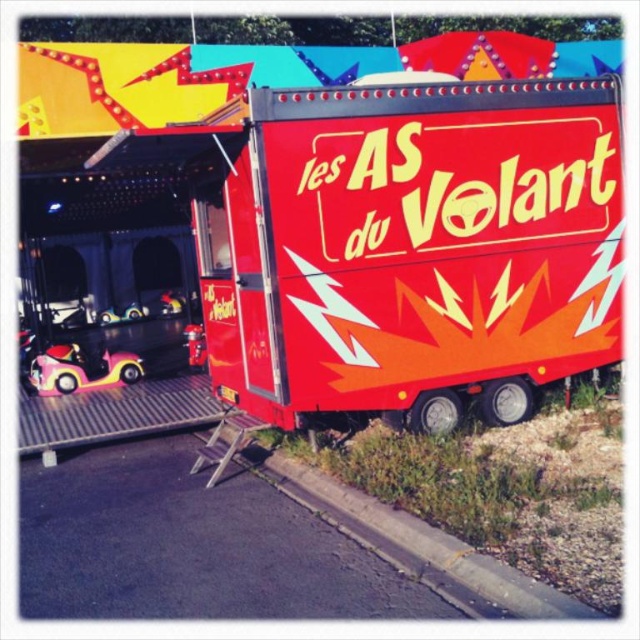
Who is taller, shiny red trailer truck at center or pink rubber bumper car at lower left?

Standing taller between the two is shiny red trailer truck at center.

Looking at this image, which is more to the left, shiny red trailer truck at center or pink rubber bumper car at lower left?

Positioned to the left is pink rubber bumper car at lower left.

Identify the location of shiny red trailer truck at center. The image size is (640, 640). (413, 250).

Does point (492, 140) lie in front of point (202, 538)?

No, (492, 140) is behind (202, 538).

You are a GUI agent. You are given a task and a screenshot of the screen. Output one action in this format:
    pyautogui.click(x=<x>, y=<y>)
    Task: Click on the shiny red trailer truck at center
    The image size is (640, 640).
    Given the screenshot: What is the action you would take?
    pyautogui.click(x=413, y=250)

Based on the photo, is shiny red trailer truck at center below pink rubber toy car at left?

Actually, shiny red trailer truck at center is above pink rubber toy car at left.

Image resolution: width=640 pixels, height=640 pixels. Identify the location of shiny red trailer truck at center. (413, 250).

Find the location of `shiny red trailer truck at center`. shiny red trailer truck at center is located at coordinates (413, 250).